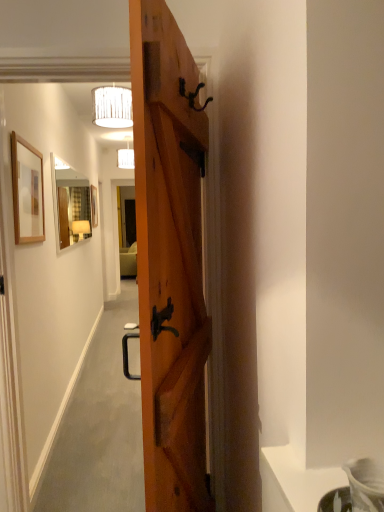
Question: Looking at their shapes, would you say white fabric lampshade at upper center, which appears as the first lamp when viewed from the right, is wider or thinner than wooden picture frame at upper left, placed as the 2th picture frame when sorted from left to right?

Choices:
 (A) wide
 (B) thin

Answer: (A)

Question: From their relative heights in the image, would you say white fabric lampshade at upper center, the second lamp when ordered from left to right, is taller or shorter than wooden picture frame at upper left, placed as the 2th picture frame when sorted from back to front?

Choices:
 (A) short
 (B) tall

Answer: (A)

Question: Which is nearer to the wooden door at center?

Choices:
 (A) wooden picture frame at upper left, placed as the 2th picture frame when sorted from left to right
 (B) matte wooden mirror at upper center
 (C) matte white lampshade at upper center, acting as the second lamp starting from the front
 (D) metallic dark brown door handle at upper center
 (E) wooden picture frame at center, placed as the first picture frame when sorted from back to front

Answer: (D)

Question: Based on their relative distances, which object is farther from the metallic dark brown door handle at upper center?

Choices:
 (A) matte white lampshade at upper center, acting as the second lamp starting from the front
 (B) matte wooden mirror at upper center
 (C) wooden picture frame at center, placed as the first picture frame when sorted from back to front
 (D) white fabric lampshade at upper center, which ranks as the 2th lamp in back-to-front order
 (E) wooden picture frame at upper left, which is the 1th picture frame from right to left

Answer: (A)